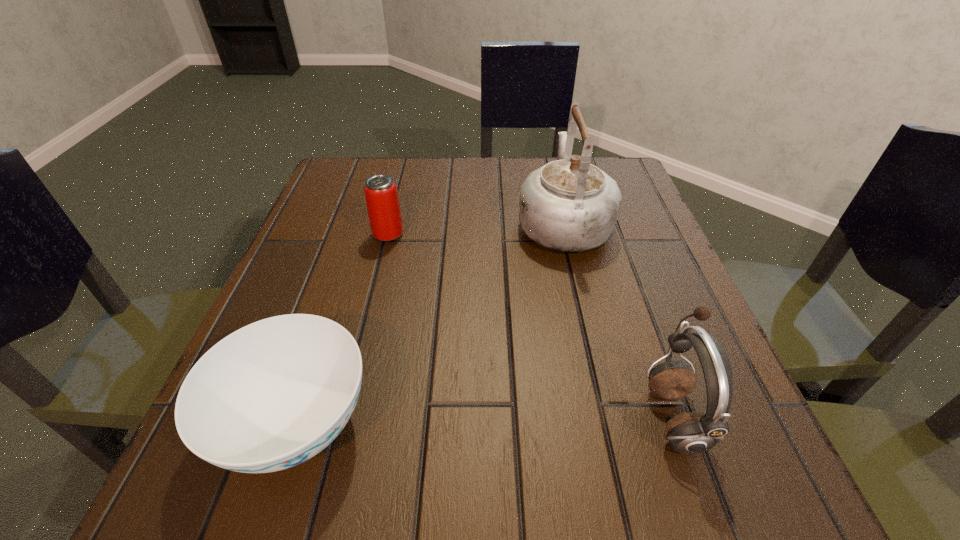
At what (x,y) coordinates should I click in order to perform the action: click on the tallest object. Please return your answer as a coordinate pair (x, y). Image resolution: width=960 pixels, height=540 pixels. Looking at the image, I should click on (569, 205).

At what (x,y) coordinates should I click in order to perform the action: click on the third shortest object. Please return your answer as a coordinate pair (x, y). The height and width of the screenshot is (540, 960). Looking at the image, I should click on (692, 432).

Where is `beer can`? The image size is (960, 540). beer can is located at coordinates (381, 195).

Where is `chinaware`? The width and height of the screenshot is (960, 540). chinaware is located at coordinates (271, 395).

Locate an element on the screen. vacant space located 0.150m at the spout of the kettle is located at coordinates (549, 160).

You are a GUI agent. You are given a task and a screenshot of the screen. Output one action in this format:
    pyautogui.click(x=<x>, y=<y>)
    Task: Click on the vacant space positioned at the spout of the kettle
    This screenshot has height=540, width=960.
    Given the screenshot: What is the action you would take?
    pyautogui.click(x=549, y=164)

Identify the location of vacant area situated at the spout of the kettle. The image size is (960, 540). (550, 165).

Image resolution: width=960 pixels, height=540 pixels. I want to click on free space located 0.200m on the ear pads of the second tallest object, so click(x=504, y=415).

Where is `free space located 0.240m on the ear pads of the second tallest object`? This screenshot has height=540, width=960. free space located 0.240m on the ear pads of the second tallest object is located at coordinates (475, 415).

Find the location of `blank space located 0.320m on the ear pads of the second tallest object`. blank space located 0.320m on the ear pads of the second tallest object is located at coordinates (x=418, y=415).